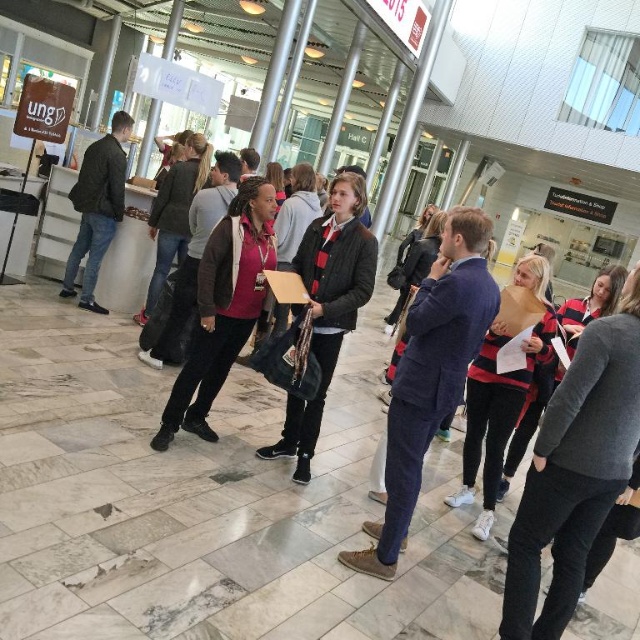
Is matte black jacket at center wider than dark gray jacket at left?

In fact, matte black jacket at center might be narrower than dark gray jacket at left.

Who is more distant from viewer, (308, 305) or (112, 204)?

The point (112, 204) is more distant.

Measure the distance between matte black jacket at center and camera.

matte black jacket at center is 3.20 meters from camera.

Locate an element on the screen. matte black jacket at center is located at coordinates (326, 307).